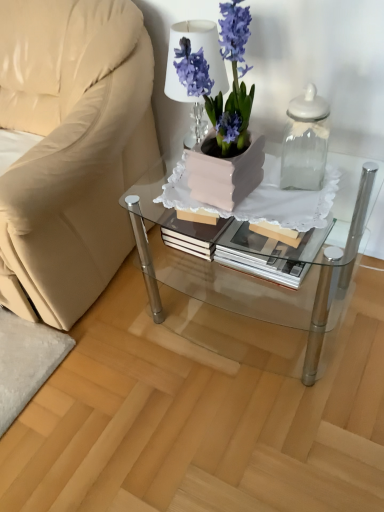
Where is `vacant space that is to the left of clear glass coffee table at center`? The image size is (384, 512). vacant space that is to the left of clear glass coffee table at center is located at coordinates (116, 353).